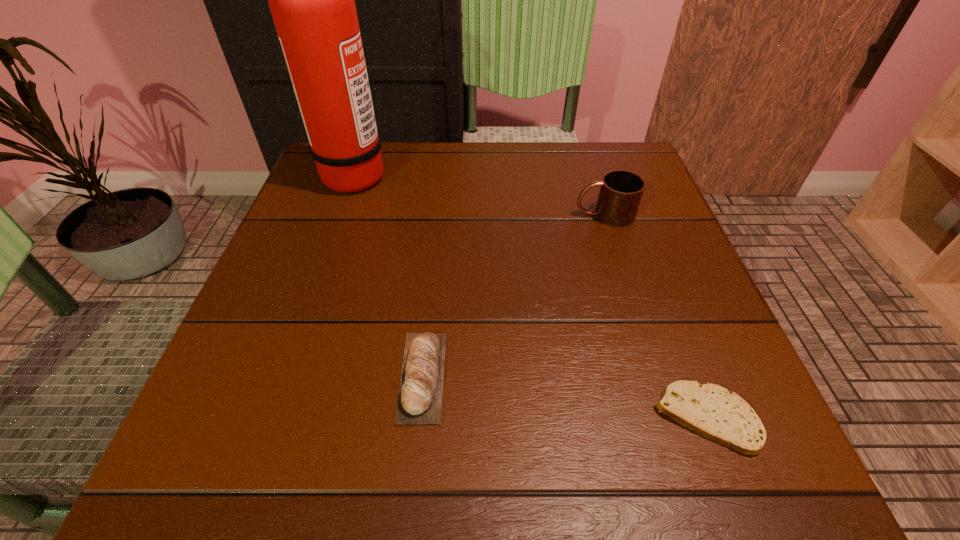
At what (x,y) coordinates should I click in order to perform the action: click on vacant space at the near edge of the desktop. Please return your answer as a coordinate pair (x, y). The image size is (960, 540). Looking at the image, I should click on (609, 479).

At what (x,y) coordinates should I click in order to perform the action: click on free space at the left edge of the desktop. Please return your answer as a coordinate pair (x, y). Looking at the image, I should click on (309, 361).

At what (x,y) coordinates should I click in order to perform the action: click on vacant space at the right edge of the desktop. Please return your answer as a coordinate pair (x, y). Image resolution: width=960 pixels, height=540 pixels. Looking at the image, I should click on tap(649, 414).

What are the coordinates of `vacant area at the far left corner of the desktop` in the screenshot? It's located at (324, 196).

In the image, there is a desktop. Where is `vacant area at the far right corner`? Image resolution: width=960 pixels, height=540 pixels. vacant area at the far right corner is located at coordinates (620, 149).

I want to click on vacant point located between the taller pita bread and the shortest object, so click(564, 396).

You are a GUI agent. You are given a task and a screenshot of the screen. Output one action in this format:
    pyautogui.click(x=<x>, y=<y>)
    Task: Click on the free space between the left pita bread and the right pita bread
    The image size is (960, 540).
    Given the screenshot: What is the action you would take?
    pyautogui.click(x=564, y=396)

Identify the location of vacant area between the shortest object and the third object from right to left. (564, 396).

Find the location of a particular element. Image resolution: width=960 pixels, height=540 pixels. free space between the second tallest object and the fire extinguisher is located at coordinates (480, 194).

This screenshot has width=960, height=540. I want to click on empty space that is in between the shortest object and the mug, so click(655, 316).